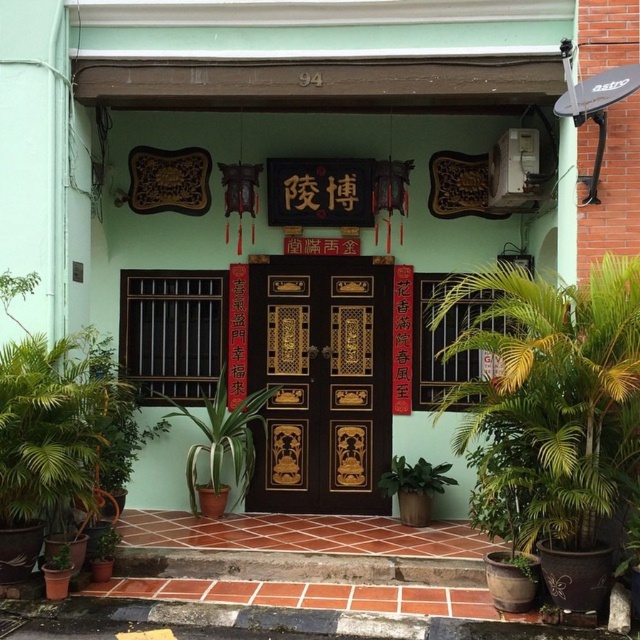
Does green glossy plant at lower right have a lesser width compared to green matte plant at lower left?

Incorrect, green glossy plant at lower right's width is not less than green matte plant at lower left's.

Is point (442, 468) positioned after point (54, 557)?

Yes, it is behind point (54, 557).

Where is `green glossy plant at lower right`? The width and height of the screenshot is (640, 640). green glossy plant at lower right is located at coordinates (413, 477).

Is green leafy plant at right closer to camera compared to green glossy plant at lower right?

Yes, it is.

Between green leafy plant at right and green glossy plant at lower right, which one appears on the right side from the viewer's perspective?

green leafy plant at right

The image size is (640, 640). What are the coordinates of `green leafy plant at right` in the screenshot? It's located at (552, 396).

This screenshot has width=640, height=640. I want to click on green leafy plant at right, so click(552, 396).

Which is below, green leafy plant at right or green matte plant at center?

green matte plant at center

Does green leafy plant at right have a larger size compared to green matte plant at center?

Correct, green leafy plant at right is larger in size than green matte plant at center.

Is point (636, 352) more distant than point (193, 445)?

No, (636, 352) is in front of (193, 445).

Identify the location of green leafy plant at right. (552, 396).